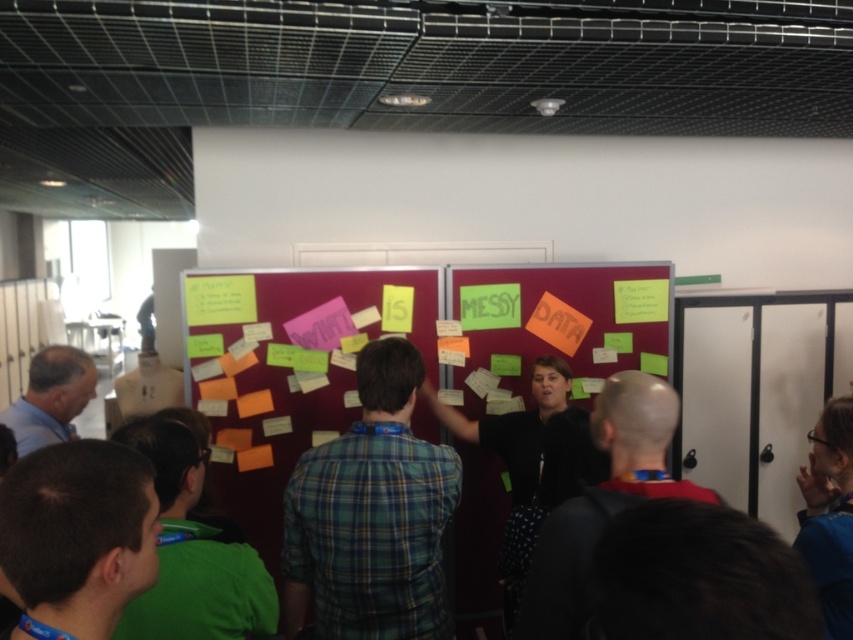
Does blue fabric shirt at upper right appear over light brown leather jacket at lower left?

No.

Looking at this image, does blue fabric shirt at upper right appear on the left side of light brown leather jacket at lower left?

No, blue fabric shirt at upper right is not to the left of light brown leather jacket at lower left.

Between point (808, 465) and point (61, 401), which one is positioned in front?

Point (61, 401) is in front.

The image size is (853, 640). What are the coordinates of `blue fabric shirt at upper right` in the screenshot? It's located at (828, 515).

In the scene shown: Is maroon fabric bulletin board at center to the left of green plaid shirt at lower left from the viewer's perspective?

In fact, maroon fabric bulletin board at center is to the right of green plaid shirt at lower left.

Is maroon fabric bulletin board at center wider than green plaid shirt at lower left?

Indeed, maroon fabric bulletin board at center has a greater width compared to green plaid shirt at lower left.

Is point (235, 452) closer to camera compared to point (45, 468)?

No, it is not.

What are the coordinates of `maroon fabric bulletin board at center` in the screenshot? It's located at coord(424,364).

Can you confirm if green plaid shirt at lower left is wider than light brown leather jacket at lower left?

Incorrect, green plaid shirt at lower left's width does not surpass light brown leather jacket at lower left's.

Does point (36, 497) come farther from viewer compared to point (78, 388)?

No, it is in front of (78, 388).

Image resolution: width=853 pixels, height=640 pixels. I want to click on green plaid shirt at lower left, so click(79, 532).